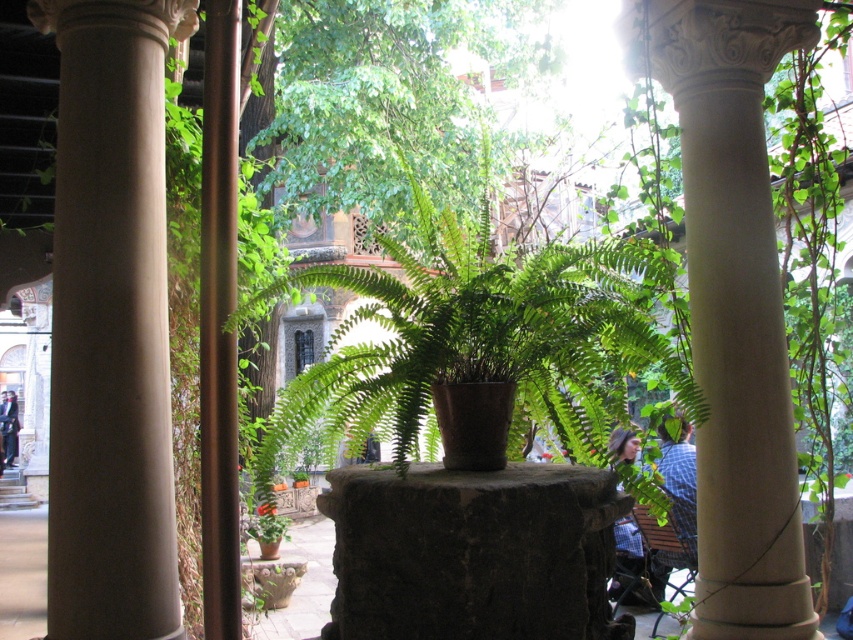
Question: Does smooth beige column at left have a greater width compared to white stone column at center?

Choices:
 (A) no
 (B) yes

Answer: (A)

Question: Which object is farther from the camera taking this photo?

Choices:
 (A) white stone column at center
 (B) smooth beige column at left

Answer: (A)

Question: Is smooth beige column at left bigger than white stone column at center?

Choices:
 (A) yes
 (B) no

Answer: (B)

Question: Which point is farther from the camera taking this photo?

Choices:
 (A) (132, 83)
 (B) (788, 465)

Answer: (B)

Question: Can you confirm if smooth beige column at left is wider than white stone column at center?

Choices:
 (A) yes
 (B) no

Answer: (B)